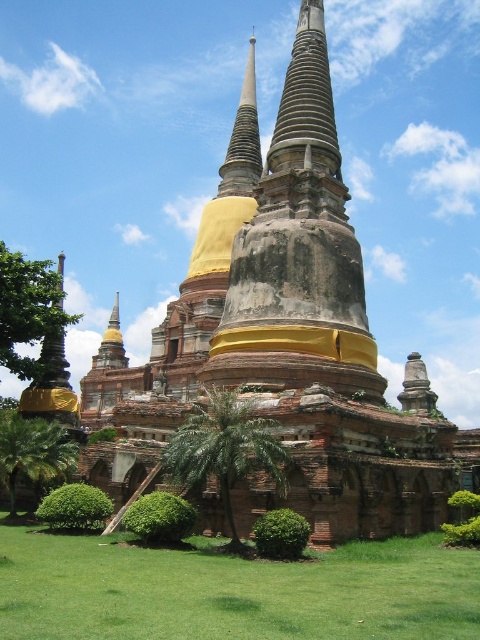
You are standing at the base of the temple steps in the image. Looking towards the central stupa towers, there is a point marked at coordinates point (225, 451). What object is located at this point?

The point (225, 451) corresponds to a green leafy palm at center.

You are standing at the base of the temple complex and want to reach the point marked by point (0,348). There is an obstacle at point (187,480). Can you walk directly to your destination without going around the obstacle?

Point (187,480) is in front of point (0,348), so you cannot walk directly to point (0,348) without going around the obstacle at point (187,480).